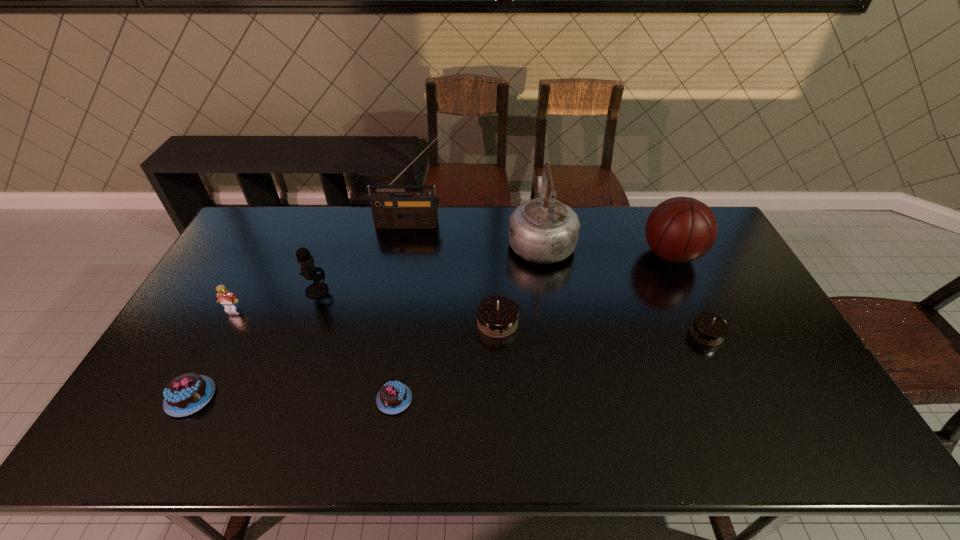
The image size is (960, 540). I want to click on the right chocolate chocolate cake, so click(709, 329).

Identify the location of the leftmost chocolate cake. (187, 393).

The width and height of the screenshot is (960, 540). I want to click on the bigger pink chocolate cake, so click(x=187, y=393).

Locate an element on the screen. the third chocolate cake from right to left is located at coordinates (394, 397).

Locate an element on the screen. the smaller pink chocolate cake is located at coordinates (394, 397).

At what (x,y) coordinates should I click in order to perform the action: click on free location located on the front-facing side of the tallest object. Please return your answer as a coordinate pair (x, y). Looking at the image, I should click on 402,264.

The image size is (960, 540). I want to click on vacant space located on the left of the basketball, so click(625, 255).

Image resolution: width=960 pixels, height=540 pixels. I want to click on vacant space situated 0.180m on the back of the black microphone, so click(333, 246).

I want to click on free space located 0.300m on the front-facing side of the Lego, so click(x=182, y=401).

Locate an element on the screen. vacant space located on the left of the left chocolate chocolate cake is located at coordinates (396, 322).